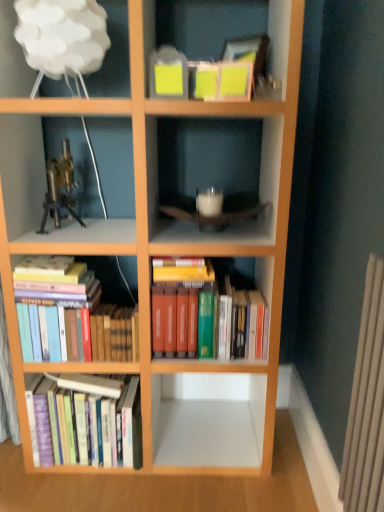
Locate an element on the screen. hardcover books at lower left, which is the 1th book from left to right is located at coordinates (84, 420).

Image resolution: width=384 pixels, height=512 pixels. What are the coordinates of `gold metallic microscope at upper left` in the screenshot? It's located at (59, 188).

The width and height of the screenshot is (384, 512). What do you see at coordinates (59, 188) in the screenshot?
I see `gold metallic microscope at upper left` at bounding box center [59, 188].

How much space does hardcover books at lower left, positioned as the 2th book in left-to-right order, occupy horizontally?

hardcover books at lower left, positioned as the 2th book in left-to-right order, is 6.59 inches wide.

Where is `white cloud lampshade at upper left`? The width and height of the screenshot is (384, 512). white cloud lampshade at upper left is located at coordinates (113, 55).

Image resolution: width=384 pixels, height=512 pixels. In order to click on hardcover books at lower left, which is the 3th book in right-to-left order in this screenshot , I will do `click(84, 420)`.

Considering the relative sizes of hardcover books at center, placed as the first book when sorted from right to left, and white cloud lampshade at upper left in the image provided, is hardcover books at center, placed as the first book when sorted from right to left, bigger than white cloud lampshade at upper left?

Yes.

Considering the sizes of objects hardcover books at center, placed as the first book when sorted from right to left, and white cloud lampshade at upper left in the image provided, who is taller, hardcover books at center, placed as the first book when sorted from right to left, or white cloud lampshade at upper left?

Standing taller between the two is hardcover books at center, placed as the first book when sorted from right to left.

From the image's perspective, between hardcover books at center, marked as the 3th book in a left-to-right arrangement, and white cloud lampshade at upper left, who is located below?

hardcover books at center, marked as the 3th book in a left-to-right arrangement.

Considering the positions of objects hardcover books at center, placed as the first book when sorted from right to left, and white cloud lampshade at upper left in the image provided, who is more to the right, hardcover books at center, placed as the first book when sorted from right to left, or white cloud lampshade at upper left?

Positioned to the right is hardcover books at center, placed as the first book when sorted from right to left.

Is hardcover books at lower left, positioned as the 2th book in left-to-right order, positioned beyond the bounds of hardcover books at center, marked as the 3th book in a left-to-right arrangement?

hardcover books at lower left, positioned as the 2th book in left-to-right order, is positioned outside hardcover books at center, marked as the 3th book in a left-to-right arrangement.

Is hardcover books at lower left, positioned as the 2th book in left-to-right order, beside hardcover books at center, placed as the first book when sorted from right to left?

No, hardcover books at lower left, positioned as the 2th book in left-to-right order, is not with hardcover books at center, placed as the first book when sorted from right to left.

Between point (85, 301) and point (246, 318), which one is positioned behind?

The point (246, 318) is farther from the camera.

Is hardcover books at lower left, positioned as the 2th book in left-to-right order, oriented towards hardcover books at center, marked as the 3th book in a left-to-right arrangement?

No, hardcover books at lower left, positioned as the 2th book in left-to-right order, does not turn towards hardcover books at center, marked as the 3th book in a left-to-right arrangement.

Considering the relative sizes of gold metallic microscope at upper left and hardcover books at lower left, which is the 1th book from left to right, in the image provided, is gold metallic microscope at upper left wider than hardcover books at lower left, which is the 1th book from left to right,?

No.

Is gold metallic microscope at upper left facing away from hardcover books at lower left, which is the 3th book in right-to-left order?

No, hardcover books at lower left, which is the 3th book in right-to-left order, is not at the back of gold metallic microscope at upper left.

Visually, is gold metallic microscope at upper left positioned to the left or to the right of hardcover books at lower left, which is the 1th book from left to right?

gold metallic microscope at upper left is positioned on hardcover books at lower left, which is the 1th book from left to right,'s left side.

From the image's perspective, is white cloud lampshade at upper left positioned above or below hardcover books at lower left, which is the 1th book from left to right?

Based on their image positions, white cloud lampshade at upper left is located above hardcover books at lower left, which is the 1th book from left to right.

Considering the positions of point (112, 5) and point (103, 399), is point (112, 5) closer or farther from the camera than point (103, 399)?

Point (112, 5).

Are white cloud lampshade at upper left and hardcover books at lower left, which is the 1th book from left to right, making contact?

No, white cloud lampshade at upper left is not touching hardcover books at lower left, which is the 1th book from left to right.

In terms of size, does white cloud lampshade at upper left appear bigger or smaller than hardcover books at lower left, which is the 1th book from left to right?

Considering their sizes, white cloud lampshade at upper left takes up less space than hardcover books at lower left, which is the 1th book from left to right.

How different are the orientations of hardcover books at lower left, which is the 1th book from left to right, and hardcover books at center, placed as the first book when sorted from right to left, in degrees?

There is a 3.2-degree angle between the facing directions of hardcover books at lower left, which is the 1th book from left to right, and hardcover books at center, placed as the first book when sorted from right to left.

Who is more distant, hardcover books at lower left, which is the 3th book in right-to-left order, or hardcover books at center, placed as the first book when sorted from right to left?

hardcover books at lower left, which is the 3th book in right-to-left order, is more distant.

From the image's perspective, between hardcover books at lower left, which is the 3th book in right-to-left order, and hardcover books at center, placed as the first book when sorted from right to left, who is located below?

hardcover books at lower left, which is the 3th book in right-to-left order, is shown below in the image.

Is hardcover books at lower left, which is the 3th book in right-to-left order, smaller than hardcover books at center, placed as the first book when sorted from right to left?

Indeed, hardcover books at lower left, which is the 3th book in right-to-left order, has a smaller size compared to hardcover books at center, placed as the first book when sorted from right to left.

Between point (67, 337) and point (55, 170), which one is positioned in front?

The point (67, 337) is in front.

Is hardcover books at lower left, positioned as the 2th book in left-to-right order, oriented away from gold metallic microscope at upper left?

No, hardcover books at lower left, positioned as the 2th book in left-to-right order, is not facing the opposite direction of gold metallic microscope at upper left.

Which is more to the right, hardcover books at lower left, positioned as the 2th book in left-to-right order, or gold metallic microscope at upper left?

From the viewer's perspective, hardcover books at lower left, positioned as the 2th book in left-to-right order, appears more on the right side.

Where is `shelf located above the gold metallic microscope at upper left (from the image's perspective)`? The image size is (384, 512). shelf located above the gold metallic microscope at upper left (from the image's perspective) is located at coordinates (113, 55).

From a real-world perspective, is white cloud lampshade at upper left positioned under gold metallic microscope at upper left based on gravity?

No, from a real-world perspective, white cloud lampshade at upper left is not below gold metallic microscope at upper left.

Considering the relative sizes of white cloud lampshade at upper left and gold metallic microscope at upper left in the image provided, is white cloud lampshade at upper left shorter than gold metallic microscope at upper left?

Yes, white cloud lampshade at upper left is shorter than gold metallic microscope at upper left.

From the image's perspective, is white cloud lampshade at upper left above gold metallic microscope at upper left?

Yes, from the image's perspective, white cloud lampshade at upper left is on top of gold metallic microscope at upper left.

Which book is the 2nd one when counting from the back of the white cloud lampshade at upper left? Please provide its 2D coordinates.

[(206, 313)]

The width and height of the screenshot is (384, 512). In order to click on the 1st book to the left of the hardcover books at center, marked as the 3th book in a left-to-right arrangement, counting from the anchor's position in this screenshot , I will do `click(71, 315)`.

Considering their positions, is white cloud lampshade at upper left positioned further to hardcover books at lower left, which is the 3th book in right-to-left order, than gold metallic microscope at upper left?

white cloud lampshade at upper left is further to hardcover books at lower left, which is the 3th book in right-to-left order.

Considering their positions, is hardcover books at lower left, which is the 1th book from left to right, positioned further to hardcover books at center, marked as the 3th book in a left-to-right arrangement, than gold metallic microscope at upper left?

Among the two, gold metallic microscope at upper left is located further to hardcover books at center, marked as the 3th book in a left-to-right arrangement.

Estimate the real-world distances between objects in this image. Which object is closer to hardcover books at lower left, positioned as the 2th book in left-to-right order, white cloud lampshade at upper left or hardcover books at lower left, which is the 3th book in right-to-left order?

hardcover books at lower left, which is the 3th book in right-to-left order.

From the picture: Considering their positions, is hardcover books at lower left, which is the 3th book in right-to-left order, positioned further to white cloud lampshade at upper left than gold metallic microscope at upper left?

Based on the image, hardcover books at lower left, which is the 3th book in right-to-left order, appears to be further to white cloud lampshade at upper left.

Estimate the real-world distances between objects in this image. Which object is closer to hardcover books at lower left, which is the 3th book in right-to-left order, gold metallic microscope at upper left or hardcover books at center, marked as the 3th book in a left-to-right arrangement?

hardcover books at center, marked as the 3th book in a left-to-right arrangement, is closer to hardcover books at lower left, which is the 3th book in right-to-left order.

Which object lies further to the anchor point hardcover books at lower left, positioned as the 2th book in left-to-right order, white cloud lampshade at upper left or gold metallic microscope at upper left?

white cloud lampshade at upper left lies further to hardcover books at lower left, positioned as the 2th book in left-to-right order, than the other object.

Estimate the real-world distances between objects in this image. Which object is further from hardcover books at lower left, positioned as the 2th book in left-to-right order, gold metallic microscope at upper left or white cloud lampshade at upper left?

white cloud lampshade at upper left lies further to hardcover books at lower left, positioned as the 2th book in left-to-right order, than the other object.

Based on their spatial positions, is hardcover books at lower left, which is the 3th book in right-to-left order, or hardcover books at center, placed as the first book when sorted from right to left, further from white cloud lampshade at upper left?

Among the two, hardcover books at lower left, which is the 3th book in right-to-left order, is located further to white cloud lampshade at upper left.

Find the location of `book between white cloud lampshade at upper left and hardcover books at lower left, positioned as the 2th book in left-to-right order, in the up-down direction`. book between white cloud lampshade at upper left and hardcover books at lower left, positioned as the 2th book in left-to-right order, in the up-down direction is located at coordinates (206, 313).

Locate an element on the screen. book situated between hardcover books at lower left, which is the 3th book in right-to-left order, and hardcover books at center, marked as the 3th book in a left-to-right arrangement, from left to right is located at coordinates (71, 315).

Where is `toy that lies between white cloud lampshade at upper left and hardcover books at lower left, which is the 3th book in right-to-left order, from top to bottom`? The height and width of the screenshot is (512, 384). toy that lies between white cloud lampshade at upper left and hardcover books at lower left, which is the 3th book in right-to-left order, from top to bottom is located at coordinates (59, 188).

This screenshot has width=384, height=512. Identify the location of toy between white cloud lampshade at upper left and hardcover books at center, placed as the first book when sorted from right to left, in the up-down direction. (59, 188).